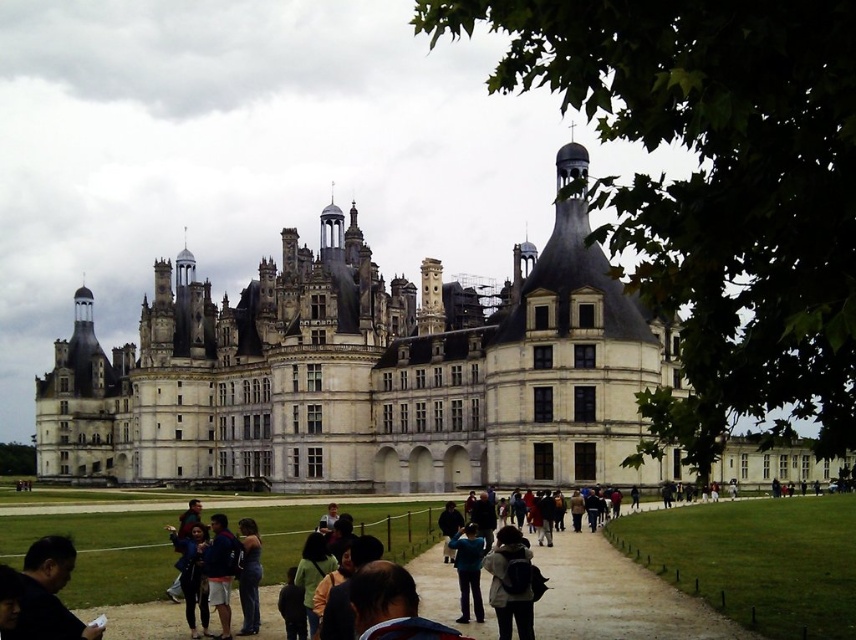
You are standing at the entrance of the white stone castle at center and want to greet the person wearing the denim jacket at lower left. In which direction should you walk to reach them?

The white stone castle at center is positioned on the right side of denim jacket at lower left, so you should walk to your left to reach the person wearing the denim jacket at lower left.

You are standing at the point closest to the castle along the pathway. There are two points marked on the path, one at coordinates point (x=601, y=545) and the other at point (x=503, y=579). Which point should you walk towards to get closer to the castle?

You should walk towards point (x=503, y=579) because it is closer to the castle than point (x=601, y=545), which is behind it.

You are standing on the paved pathway leading to the white stone castle at center and want to give a souvenir to the person wearing the denim jacket at lower left. Which direction should you walk to reach them?

The denim jacket at lower left is closer to you than the white stone castle at center, so you should walk towards the denim jacket at lower left, which is in the foreground. Since the denim jacket is at lower left, you should move toward the lower left direction from your current position on the pathway.